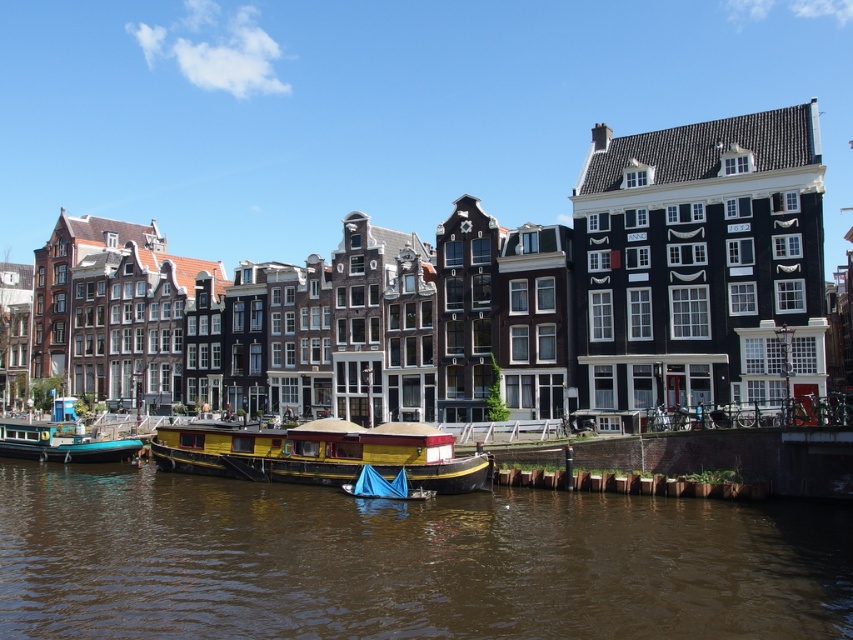
Does yellow painted wood houseboat at center appear on the right side of teal glossy houseboat at lower left?

Correct, you'll find yellow painted wood houseboat at center to the right of teal glossy houseboat at lower left.

Can you confirm if yellow painted wood houseboat at center is thinner than teal glossy houseboat at lower left?

No, yellow painted wood houseboat at center is not thinner than teal glossy houseboat at lower left.

Identify the location of yellow painted wood houseboat at center. (321, 452).

Is brown water at lower center taller than yellow painted wood houseboat at center?

No.

Measure the distance between brown water at lower center and yellow painted wood houseboat at center.

brown water at lower center and yellow painted wood houseboat at center are 28.04 feet apart from each other.

Identify the location of brown water at lower center. The image size is (853, 640). (405, 561).

Is point (643, 561) positioned in front of point (125, 444)?

Yes, point (643, 561) is in front of point (125, 444).

Who is lower down, brown water at lower center or teal glossy houseboat at lower left?

brown water at lower center

The width and height of the screenshot is (853, 640). In order to click on brown water at lower center in this screenshot , I will do `click(405, 561)`.